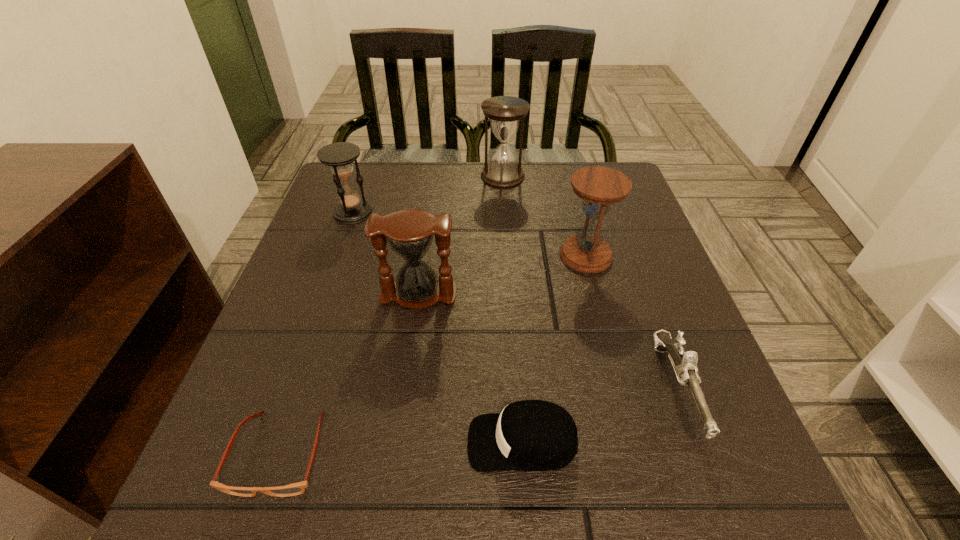
This screenshot has width=960, height=540. Find the location of `vacant region that satisfies the following two spatial constraints: 1. on the front side of the third object from left to right; 2. on the right side of the second farthest object`. vacant region that satisfies the following two spatial constraints: 1. on the front side of the third object from left to right; 2. on the right side of the second farthest object is located at coordinates (324, 294).